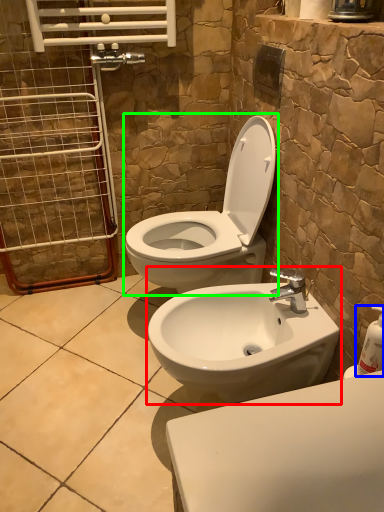
Question: Estimate the real-world distances between objects in this image. Which object is closer to sink (highlighted by a red box), soap dispenser (highlighted by a blue box) or toilet (highlighted by a green box)?

Choices:
 (A) soap dispenser
 (B) toilet

Answer: (B)